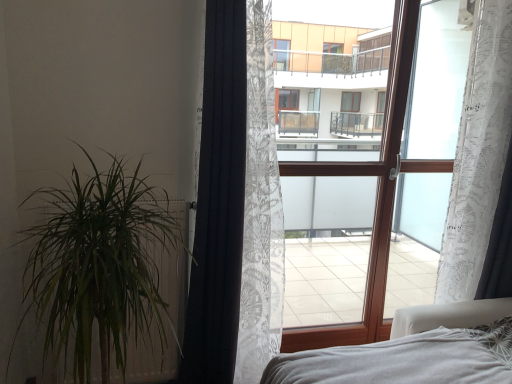
Question: Is black textured curtain at left, marked as the 1th curtain in a left-to-right arrangement, to the left of green leafy plant at left from the viewer's perspective?

Choices:
 (A) yes
 (B) no

Answer: (B)

Question: Is the position of black textured curtain at left, marked as the 1th curtain in a left-to-right arrangement, more distant than that of green leafy plant at left?

Choices:
 (A) no
 (B) yes

Answer: (B)

Question: From a real-world perspective, is black textured curtain at left, acting as the 3th curtain starting from the right, physically below green leafy plant at left?

Choices:
 (A) no
 (B) yes

Answer: (A)

Question: Is black textured curtain at left, marked as the 1th curtain in a left-to-right arrangement, closer to camera compared to green leafy plant at left?

Choices:
 (A) no
 (B) yes

Answer: (A)

Question: From a real-world perspective, is black textured curtain at left, marked as the 1th curtain in a left-to-right arrangement, over green leafy plant at left?

Choices:
 (A) no
 (B) yes

Answer: (B)

Question: Is black textured curtain at left, acting as the 3th curtain starting from the right, smaller than green leafy plant at left?

Choices:
 (A) yes
 (B) no

Answer: (A)

Question: From a real-world perspective, is white sheer curtain at right over white lace curtain at right, the 2th curtain in the left-to-right sequence?

Choices:
 (A) no
 (B) yes

Answer: (A)

Question: Considering the relative sizes of white sheer curtain at right and white lace curtain at right, the second curtain in the right-to-left sequence, in the image provided, is white sheer curtain at right taller than white lace curtain at right, the second curtain in the right-to-left sequence,?

Choices:
 (A) no
 (B) yes

Answer: (B)

Question: From a real-world perspective, does white sheer curtain at right sit lower than white lace curtain at right, the second curtain in the right-to-left sequence?

Choices:
 (A) yes
 (B) no

Answer: (A)

Question: From the image's perspective, is white sheer curtain at right below white lace curtain at right, the second curtain in the right-to-left sequence?

Choices:
 (A) yes
 (B) no

Answer: (A)

Question: Considering the relative sizes of white sheer curtain at right and white lace curtain at right, the second curtain in the right-to-left sequence, in the image provided, is white sheer curtain at right smaller than white lace curtain at right, the second curtain in the right-to-left sequence,?

Choices:
 (A) yes
 (B) no

Answer: (A)

Question: Can you confirm if white sheer curtain at right is positioned to the left of white lace curtain at right, the second curtain in the right-to-left sequence?

Choices:
 (A) yes
 (B) no

Answer: (A)

Question: Does white sheer curtain at right have a greater height compared to transparent fabric at center?

Choices:
 (A) no
 (B) yes

Answer: (B)